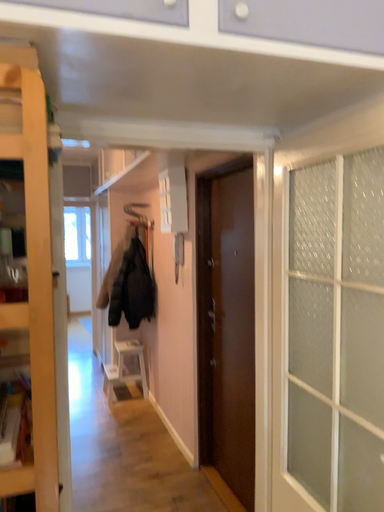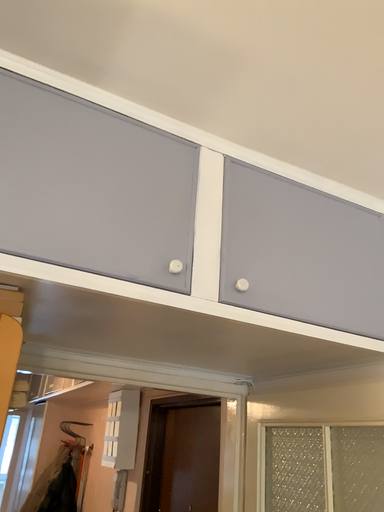
Question: Which way did the camera rotate in the video?

Choices:
 (A) rotated upward
 (B) rotated downward

Answer: (A)